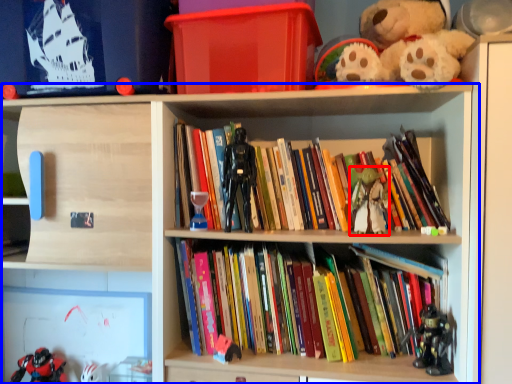
Question: Which of the following is the farthest to the observer, toy (highlighted by a red box) or shelf (highlighted by a blue box)?

Choices:
 (A) toy
 (B) shelf

Answer: (A)